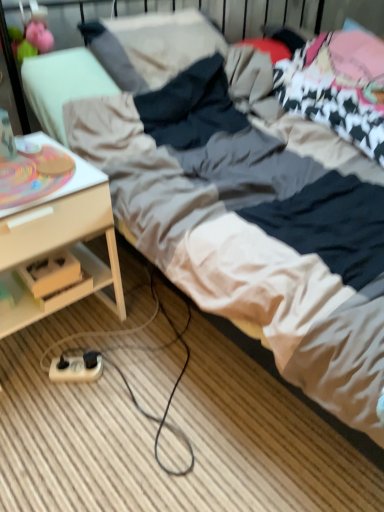
This screenshot has height=512, width=384. What are the coordinates of `free space to the back side of beige plastic extension cord at lower left` in the screenshot? It's located at (89, 332).